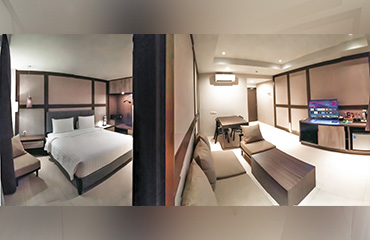
This screenshot has height=240, width=370. I want to click on curtain, so click(7, 115).